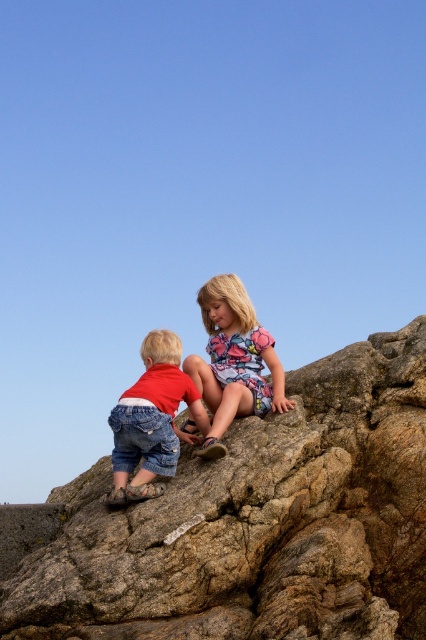
Question: From the image, what is the correct spatial relationship of brown rough rock at center in relation to denim shorts at lower left?

Choices:
 (A) above
 (B) below

Answer: (B)

Question: Considering the real-world distances, which object is closest to the brown rough rock at center?

Choices:
 (A) floral fabric dress at center
 (B) denim shorts at lower left

Answer: (B)

Question: Among these points, which one is farthest from the camera?

Choices:
 (A) (316, 515)
 (B) (149, 333)
 (C) (226, 420)

Answer: (B)

Question: Is floral fabric dress at center above denim shorts at lower left?

Choices:
 (A) no
 (B) yes

Answer: (B)

Question: Which of the following is the closest to the observer?

Choices:
 (A) (147, 406)
 (B) (198, 536)
 (C) (250, 388)

Answer: (B)

Question: Is floral fabric dress at center closer to camera compared to denim shorts at lower left?

Choices:
 (A) no
 (B) yes

Answer: (A)